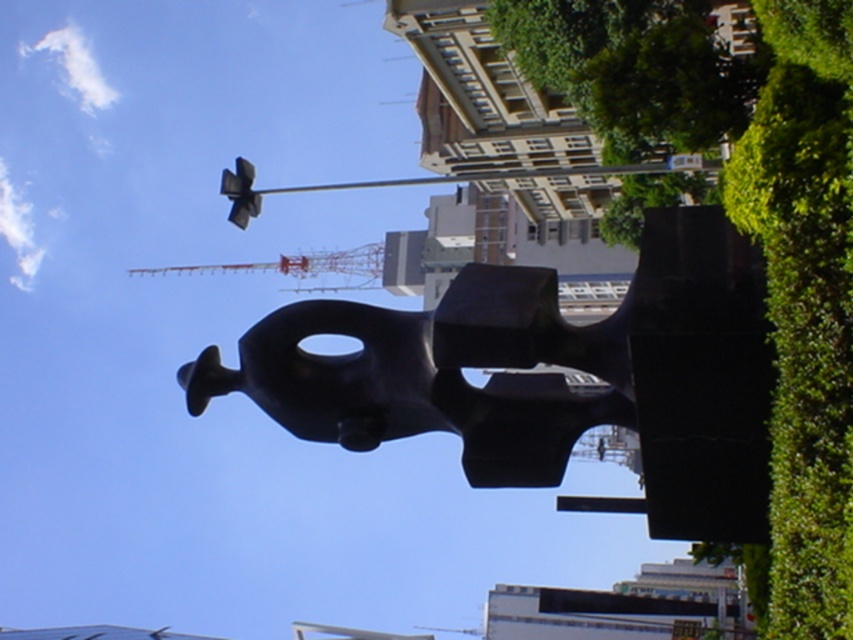
You are standing in the public square and want to take a photo of the sculpture. You notice two points on the sculpture marked as point (595, 340) and point (782, 67). Which point is closer to you when facing the sculpture?

Point (782, 67) is closer to you because it is in front of point (595, 340).

You are a gardener who needs to trim the green leafy hedge at right. You are standing next to the black matte statue at center. Which direction should you move to reach the hedge?

The green leafy hedge at right is located to the right of the black matte statue at center. So you should move to your right to reach the hedge.

You are a landscape architect planning to install a new light pole in the public square. The light pole needs to be placed such that it does not block the view of the black matte statue at center from the green leafy hedge at right. Based on their heights, can the light pole be placed between them without obstructing the view?

The black matte statue at center is shorter than the green leafy hedge at right. Since the statue is shorter, placing the light pole between them might block the view of the statue from the hedge if the pole is taller than the statue. Therefore, the light pole should be shorter than the statue to avoid obstruction.